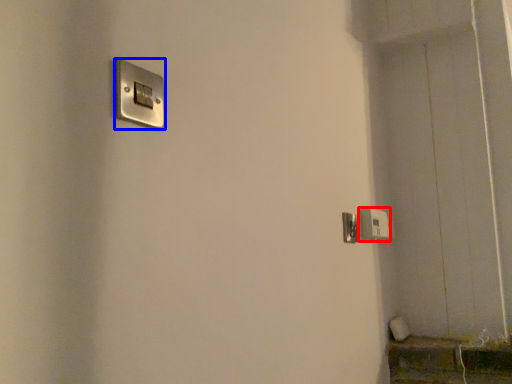
Question: Among these objects, which one is nearest to the camera, light switch (highlighted by a red box) or light switch (highlighted by a blue box)?

Choices:
 (A) light switch
 (B) light switch

Answer: (B)